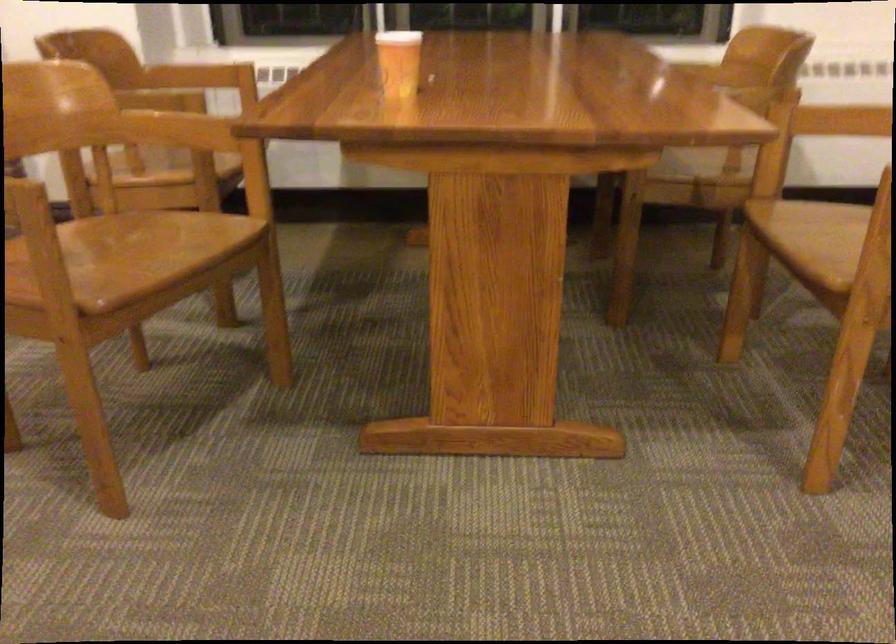
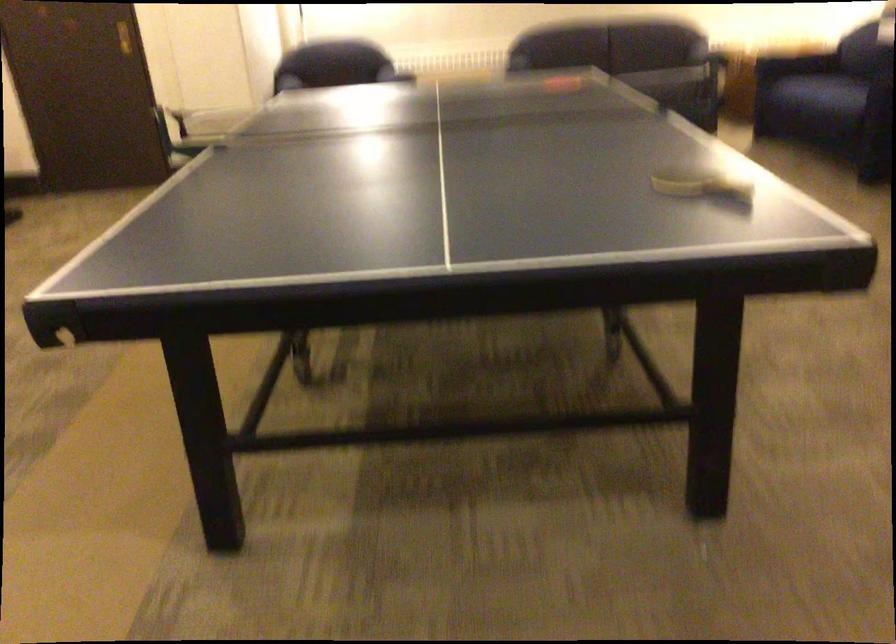
How did the camera likely rotate?

The camera rotated toward left-down.